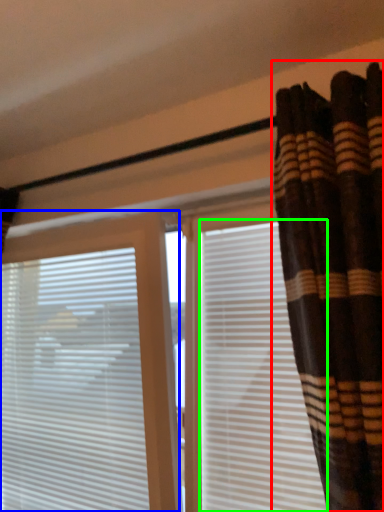
Question: Based on their relative distances, which object is farther from curtain (highlighted by a red box)? Choose from window blind (highlighted by a blue box) and shutter (highlighted by a green box).

Choices:
 (A) window blind
 (B) shutter

Answer: (A)